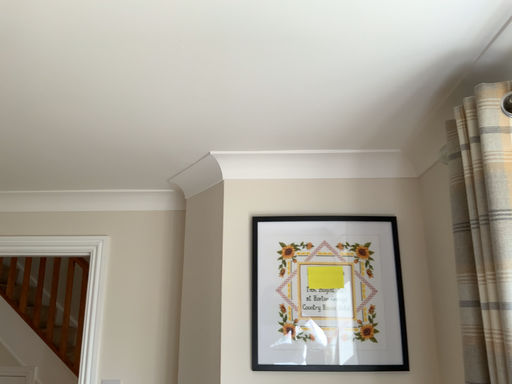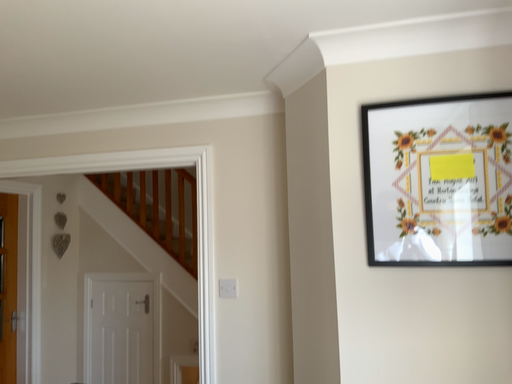
Question: How did the camera likely rotate when shooting the video?

Choices:
 (A) rotated right
 (B) rotated left

Answer: (B)